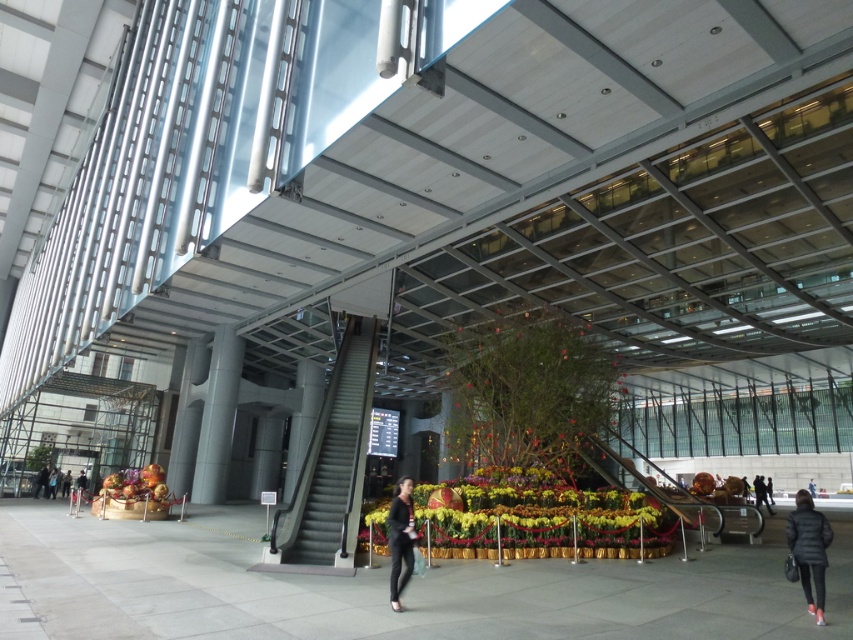
Question: Which point appears farthest from the camera in this image?

Choices:
 (A) (396, 518)
 (B) (762, 490)
 (C) (67, 492)
 (D) (662, 541)

Answer: (C)

Question: Can you confirm if yellow floral arrangement at center is wider than black leather jacket at lower right?

Choices:
 (A) no
 (B) yes

Answer: (B)

Question: Which object is the closest to the black leather jacket at lower right?

Choices:
 (A) dark gray jacket at lower left
 (B) matte black jacket at lower right
 (C) black matte pants at center
 (D) yellow floral arrangement at center

Answer: (D)

Question: Does matte black jacket at lower right have a greater width compared to black leather jacket at lower right?

Choices:
 (A) yes
 (B) no

Answer: (B)

Question: Which of these objects is positioned closest to the matte black jacket at lower right?

Choices:
 (A) black leather jacket at lower right
 (B) yellow floral arrangement at center
 (C) black matte pants at center
 (D) dark gray jacket at lower left

Answer: (B)

Question: Is black leather jacket at lower right smaller than dark gray jacket at lower left?

Choices:
 (A) no
 (B) yes

Answer: (A)